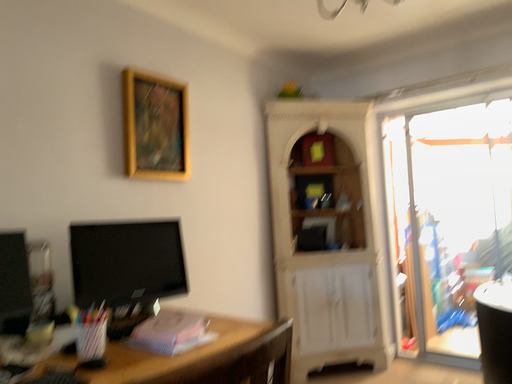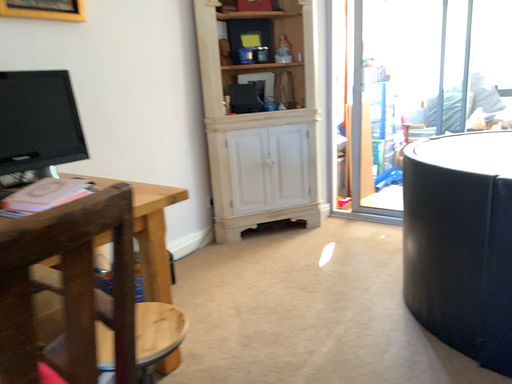
Question: How did the camera likely rotate when shooting the video?

Choices:
 (A) rotated downward
 (B) rotated upward

Answer: (A)